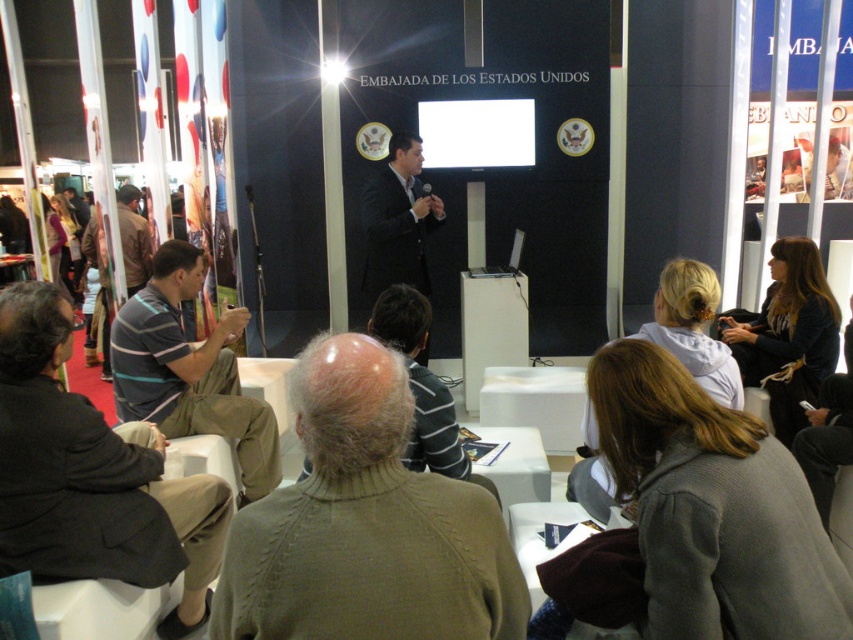
You are organizing a photo shoot and need to know which object is wider between the striped cotton shirt at left and dark brown hair at right. Which one is wider?

The striped cotton shirt at left is wider than the dark brown hair at right.

You are attending an event at the United States Embassy and notice a knitted green sweater at center. If you want to reach it without moving from your current position, can you do so?

The knitted green sweater at center is 38.48 inches from viewer, so you can reach it without moving from your current position.

You are standing at the point marked as point (198,372) in the image. You want to walk to the podium where the speaker is standing. The distance between you and the podium is 2.96 meters. If your walking speed is 1.2 meters per second, how many seconds will it take you to reach the podium?

The distance between you and the podium is 2.96 meters. At a walking speed of 1.2 meters per second, it will take approximately 2.47 seconds to reach the podium.